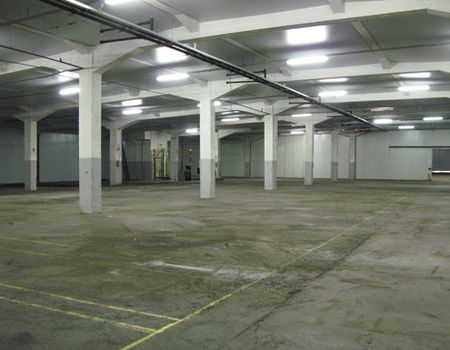
Where is `fire extinguisher`? This screenshot has height=350, width=450. fire extinguisher is located at coordinates (117, 166).